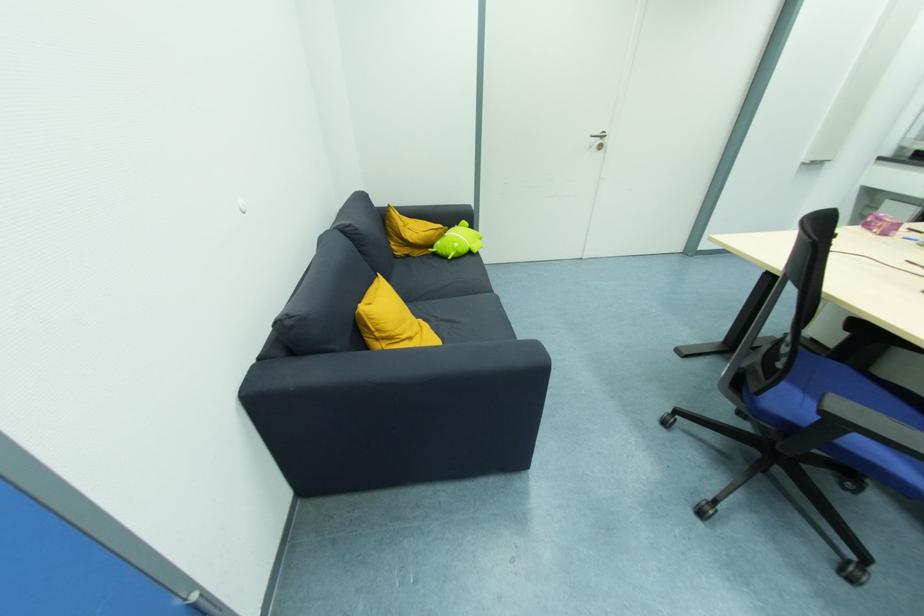
Describe the element at coordinates (398, 414) in the screenshot. I see `the sofa armrest` at that location.